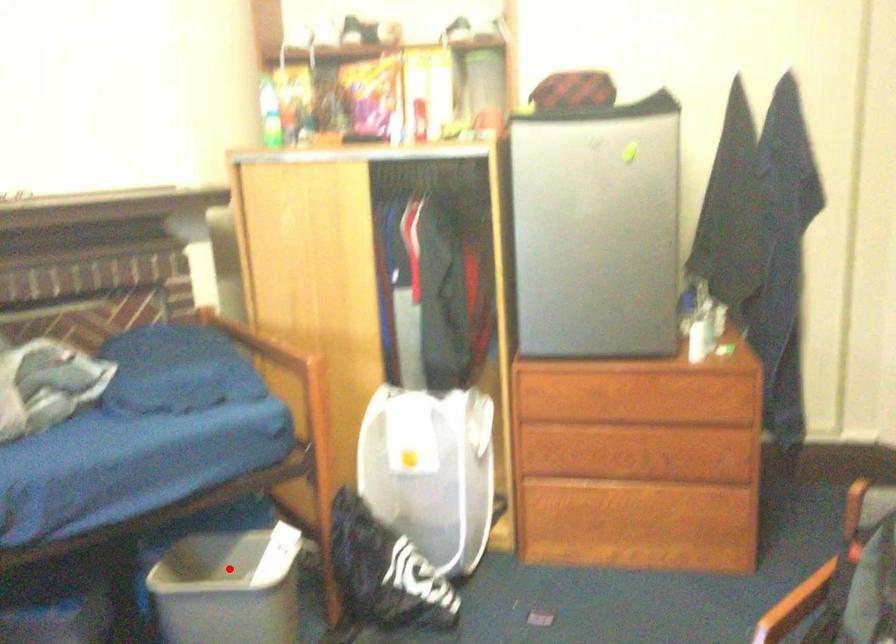
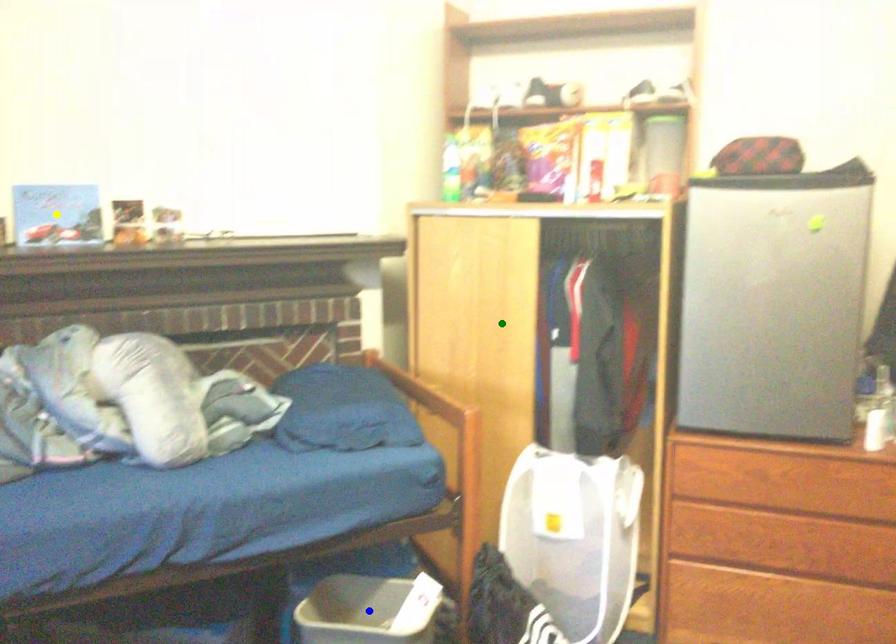
Question: I am providing you with two images of the same scene from different viewpoints. A red point is marked on the first image. You are given multiple points on the second image. Which spot in image 2 lines up with the point in image 1?

Choices:
 (A) yellow point
 (B) blue point
 (C) green point

Answer: (B)